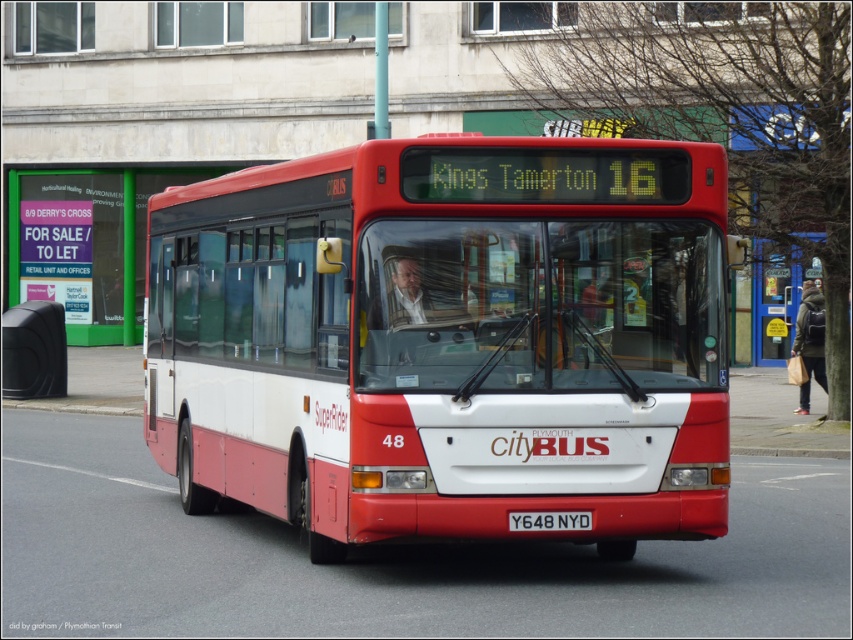
Does red matte bus at center have a greater height compared to matte black speaker at left?

In fact, red matte bus at center may be shorter than matte black speaker at left.

Between point (547, 300) and point (53, 317), which one is positioned behind?

Point (53, 317)

Is point (256, 323) in front of point (51, 328)?

Yes.

Identify the location of red matte bus at center. (447, 339).

Is matte black speaker at left to the right of black metal license plate at center from the viewer's perspective?

No, matte black speaker at left is not to the right of black metal license plate at center.

Does matte black speaker at left have a greater height compared to black metal license plate at center?

Yes, matte black speaker at left is taller than black metal license plate at center.

Find the location of a particular element. This screenshot has width=853, height=640. matte black speaker at left is located at coordinates (33, 349).

The image size is (853, 640). What are the coordinates of `matte black speaker at left` in the screenshot? It's located at (33, 349).

Does red matte bus at center have a greater height compared to black metal license plate at center?

Indeed, red matte bus at center has a greater height compared to black metal license plate at center.

Is point (375, 340) positioned behind point (508, 516)?

No, (375, 340) is closer to viewer.

You are a GUI agent. You are given a task and a screenshot of the screen. Output one action in this format:
    pyautogui.click(x=<x>, y=<y>)
    Task: Click on the red matte bus at center
    
    Given the screenshot: What is the action you would take?
    pyautogui.click(x=447, y=339)